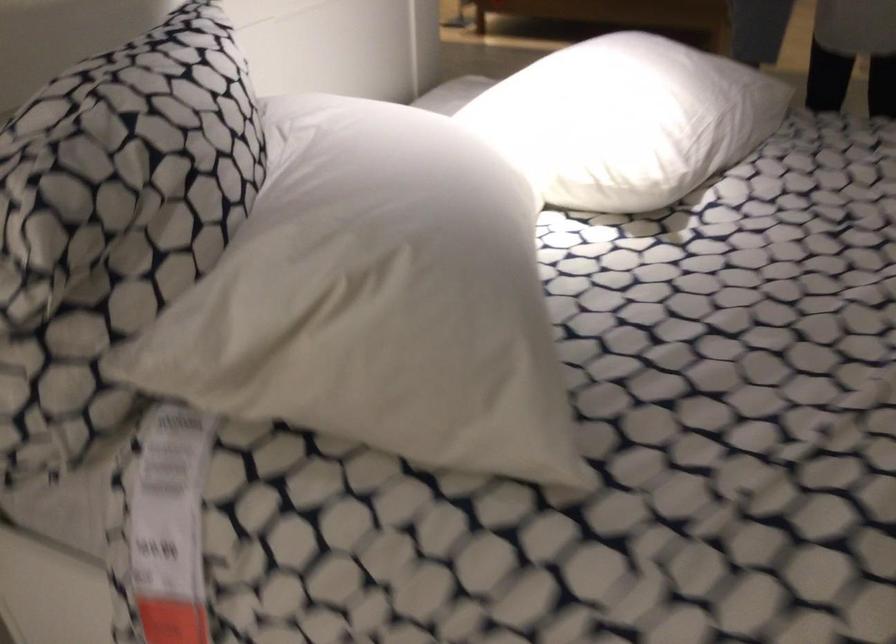
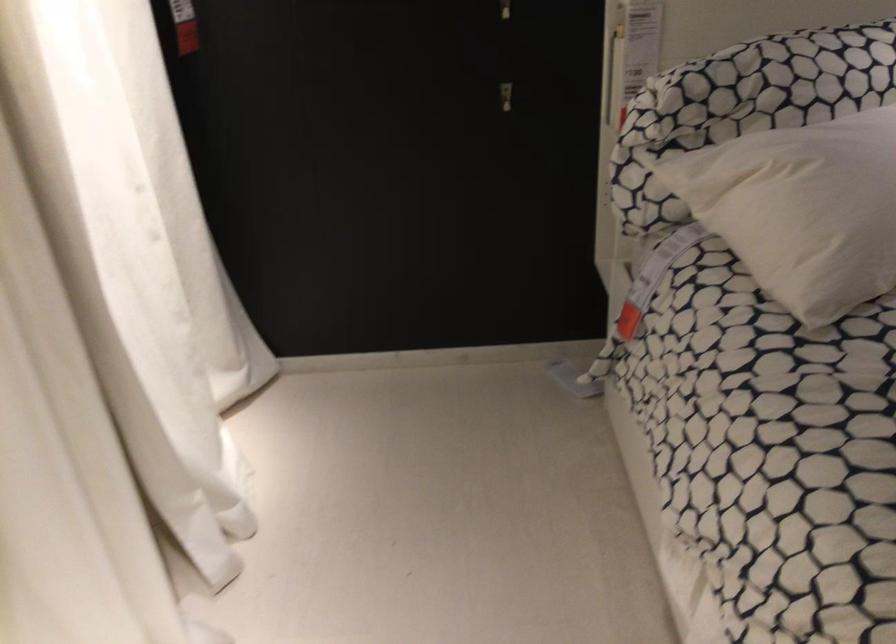
Locate, in the second image, the point that corresponds to (x=441, y=319) in the first image.

(802, 209)